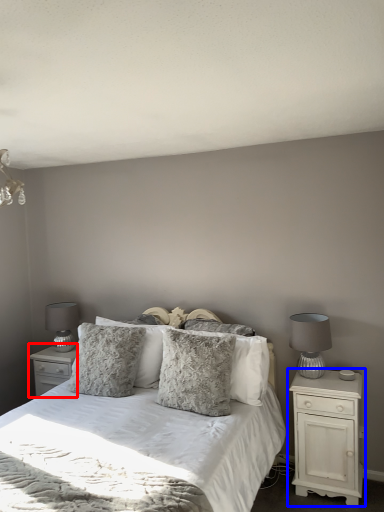
Question: Which object is closer to the camera taking this photo, nightstand (highlighted by a red box) or nightstand (highlighted by a blue box)?

Choices:
 (A) nightstand
 (B) nightstand

Answer: (B)